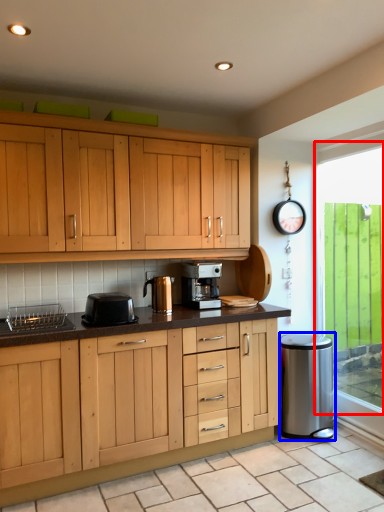
Question: Which of the following is the farthest to the observer, window (highlighted by a red box) or appliance (highlighted by a blue box)?

Choices:
 (A) window
 (B) appliance

Answer: (B)